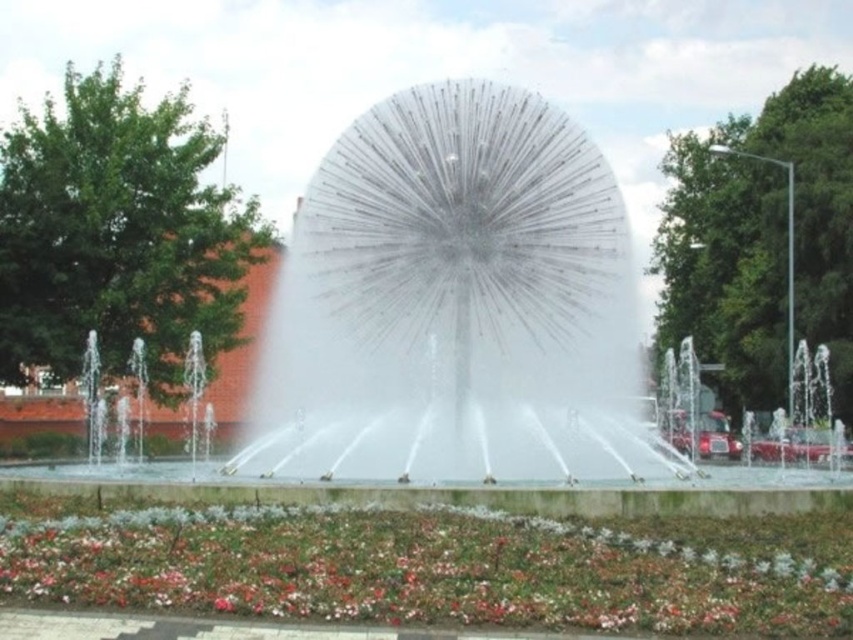
Question: Is transparent glass sphere at center bigger than multicolored fabric flower at lower center?

Choices:
 (A) no
 (B) yes

Answer: (B)

Question: Can you confirm if transparent glass sphere at center is positioned to the left of multicolored fabric flower at lower center?

Choices:
 (A) no
 (B) yes

Answer: (B)

Question: Is transparent glass sphere at center closer to camera compared to multicolored fabric flower at lower center?

Choices:
 (A) yes
 (B) no

Answer: (B)

Question: Among these points, which one is nearest to the camera?

Choices:
 (A) (300, 552)
 (B) (641, 438)

Answer: (A)

Question: Which point is farther to the camera?

Choices:
 (A) transparent glass sphere at center
 (B) multicolored fabric flower at lower center

Answer: (A)

Question: Which object appears closest to the camera in this image?

Choices:
 (A) multicolored fabric flower at lower center
 (B) transparent glass sphere at center

Answer: (A)